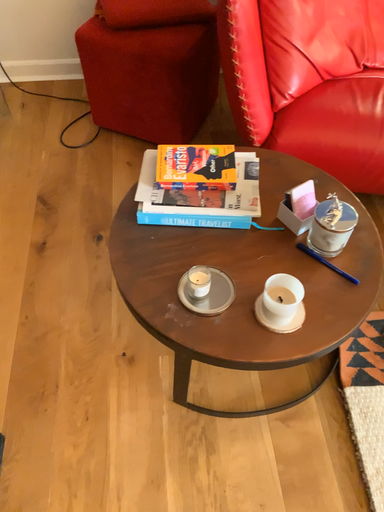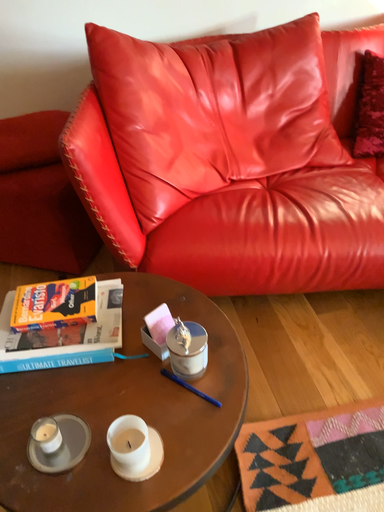
Question: Which way did the camera rotate in the video?

Choices:
 (A) rotated downward
 (B) rotated upward

Answer: (B)